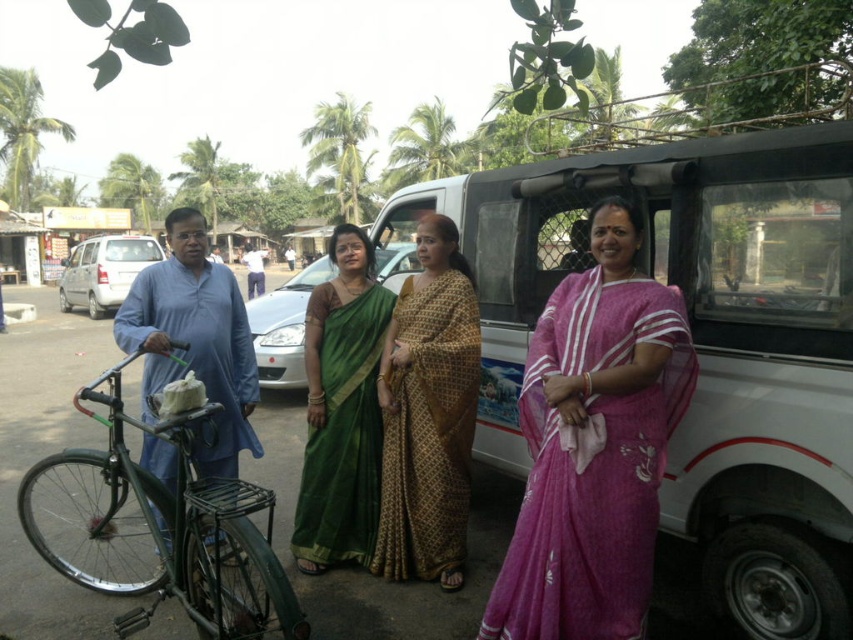
Question: Which of the following is the farthest from the observer?

Choices:
 (A) blue cotton shirt at left
 (B) green matte bicycle at left

Answer: (A)

Question: Does white plastic bus at center lie in front of gold printed saree at center?

Choices:
 (A) yes
 (B) no

Answer: (A)

Question: Considering the real-world distances, which object is farthest from the green silk saree at center?

Choices:
 (A) green matte bicycle at left
 (B) gold printed saree at center
 (C) blue cotton shirt at left

Answer: (C)

Question: Can you confirm if gold printed saree at center is positioned above blue cotton shirt at left?

Choices:
 (A) yes
 (B) no

Answer: (B)

Question: Which point is farther to the camera?

Choices:
 (A) white plastic bus at center
 (B) pink silk saree at center
 (C) gold printed saree at center

Answer: (C)

Question: Does pink silk saree at center appear on the left side of blue cotton shirt at left?

Choices:
 (A) no
 (B) yes

Answer: (A)